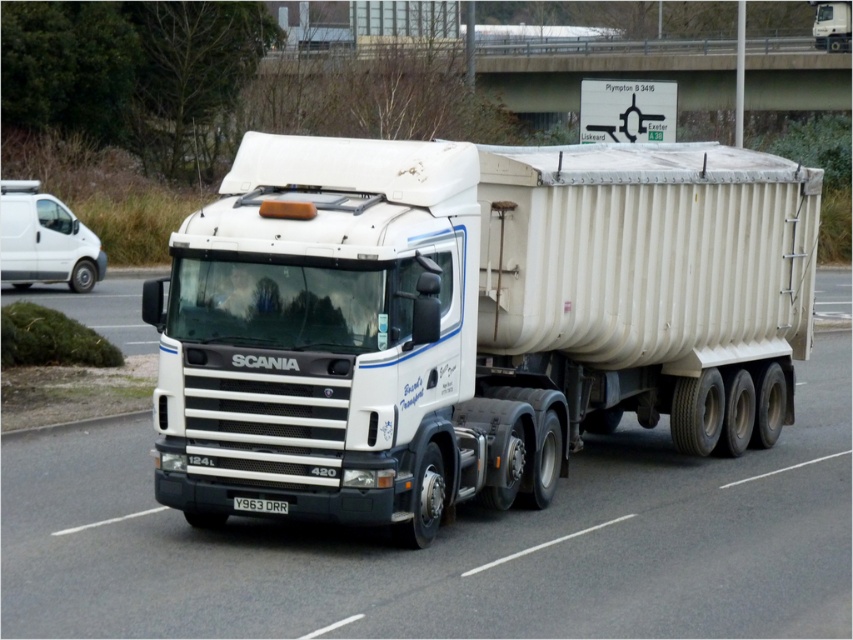
Is white matte truck at center taller than black plastic license plate at center?

No.

Consider the image. Who is higher up, white matte truck at center or black plastic license plate at center?

Positioned higher is black plastic license plate at center.

In the scene shown: Who is more forward, (228, 440) or (277, 499)?

Point (277, 499)

In order to click on white matte truck at center in this screenshot , I will do `click(469, 320)`.